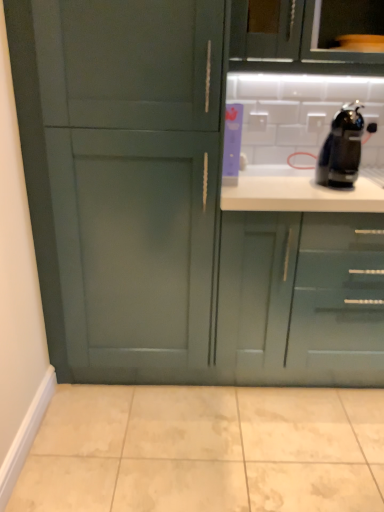
Locate an element on the screen. Image resolution: width=384 pixels, height=512 pixels. vacant space to the left of black glossy coffee machine at upper right is located at coordinates (301, 184).